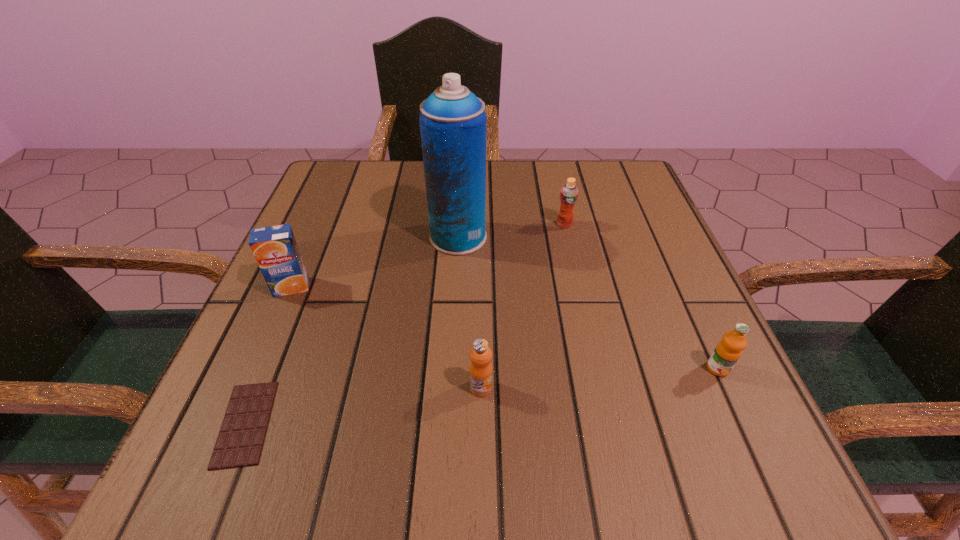
The height and width of the screenshot is (540, 960). I want to click on the tallest object, so click(x=453, y=124).

This screenshot has width=960, height=540. I want to click on the second farthest orange juice, so click(x=275, y=249).

Locate an element on the screen. The width and height of the screenshot is (960, 540). the third farthest object is located at coordinates (275, 249).

The width and height of the screenshot is (960, 540). Find the location of `the fifth object from left to right`. the fifth object from left to right is located at coordinates (569, 193).

The image size is (960, 540). Find the location of `the third orange juice from left to right`. the third orange juice from left to right is located at coordinates (569, 193).

Where is `the second orange juice from left to right`? The width and height of the screenshot is (960, 540). the second orange juice from left to right is located at coordinates (480, 370).

Where is `the rightmost object`? The height and width of the screenshot is (540, 960). the rightmost object is located at coordinates (727, 352).

Identify the location of the second nearest orange juice. This screenshot has width=960, height=540. (727, 352).

The image size is (960, 540). I want to click on the shortest object, so click(x=240, y=440).

Locate an element on the screen. Image resolution: width=960 pixels, height=540 pixels. free space located 0.070m on the left of the tallest object is located at coordinates click(396, 237).